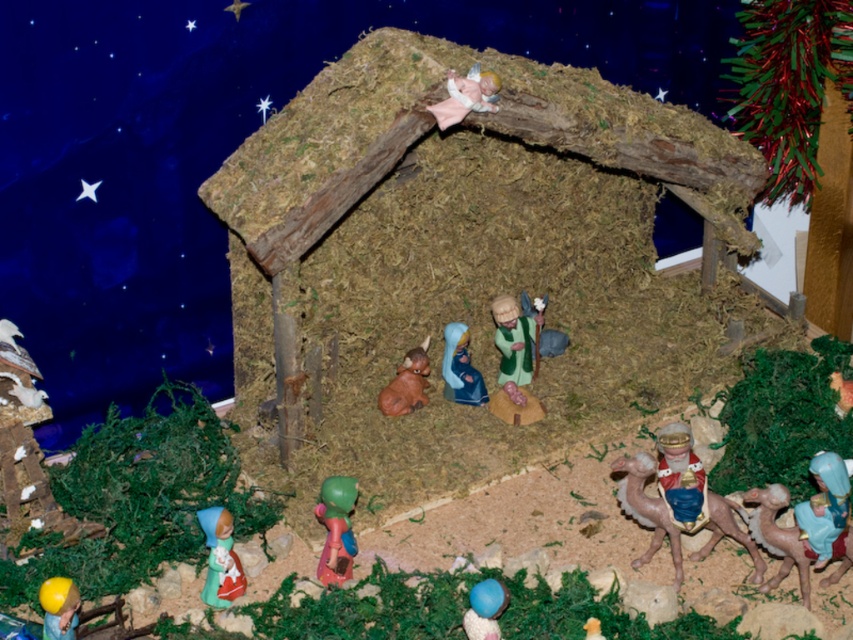
Question: Can you confirm if matte green plastic toy at lower center is smaller than smooth plastic baby at center?

Choices:
 (A) no
 (B) yes

Answer: (A)

Question: Is smooth brown mushroom at center below smooth yellow toy at lower center?

Choices:
 (A) no
 (B) yes

Answer: (A)

Question: Which object appears farthest from the camera in this image?

Choices:
 (A) blue matte figure at lower right
 (B) brown matte camel at lower right
 (C) pink fabric baby at upper center

Answer: (C)

Question: Which of the following is the farthest from the observer?

Choices:
 (A) (589, 627)
 (B) (476, 636)

Answer: (A)

Question: Is matte green plastic toy at lower center further to camera compared to pink fabric baby at upper center?

Choices:
 (A) no
 (B) yes

Answer: (A)

Question: Which point is farther to the camera?

Choices:
 (A) matte green figurine at lower left
 (B) matte green plastic toy at lower center
 (C) smooth green fabric at center

Answer: (C)